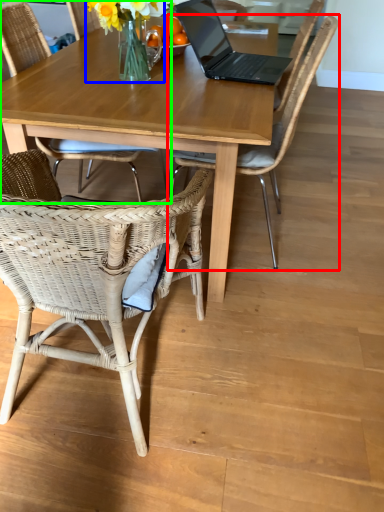
Question: Which object is positioned closest to chair (highlighted by a red box)? Select from floral arrangement (highlighted by a blue box) and chair (highlighted by a green box).

Choices:
 (A) floral arrangement
 (B) chair

Answer: (B)